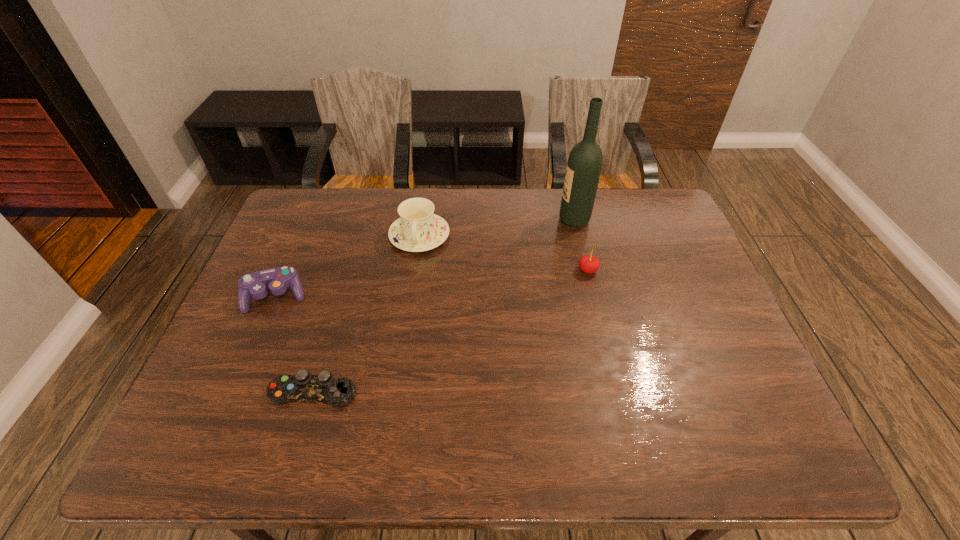
The width and height of the screenshot is (960, 540). What are the coordinates of `vacant area at the far left corner` in the screenshot? It's located at (324, 188).

The width and height of the screenshot is (960, 540). Identify the location of vacant space at the far right corner of the desktop. [657, 227].

You are a GUI agent. You are given a task and a screenshot of the screen. Output one action in this format:
    pyautogui.click(x=<x>, y=<y>)
    Task: Click on the blank region between the nearest object and the third nearest object
    This screenshot has width=960, height=540.
    Given the screenshot: What is the action you would take?
    (x=451, y=332)

At what (x,y) coordinates should I click in order to perform the action: click on vacant area that lies between the wine bottle and the cherry. Please return your answer as a coordinate pair (x, y). Looking at the image, I should click on (581, 245).

This screenshot has width=960, height=540. In order to click on vacant space that's between the tallest object and the third nearest object in this screenshot , I will do `click(581, 245)`.

Where is `unoccupied area between the wine bottle and the taller control`? unoccupied area between the wine bottle and the taller control is located at coordinates (425, 258).

Locate an element on the screen. vacant region between the chinaware and the nearest object is located at coordinates (367, 314).

Locate an element on the screen. The image size is (960, 540). vacant space in between the tallest object and the third farthest object is located at coordinates (581, 245).

Where is `blank region between the shortest object and the chinaware`? The image size is (960, 540). blank region between the shortest object and the chinaware is located at coordinates (367, 314).

This screenshot has height=540, width=960. Identify the location of vacant point located between the chinaware and the cherry. (504, 253).